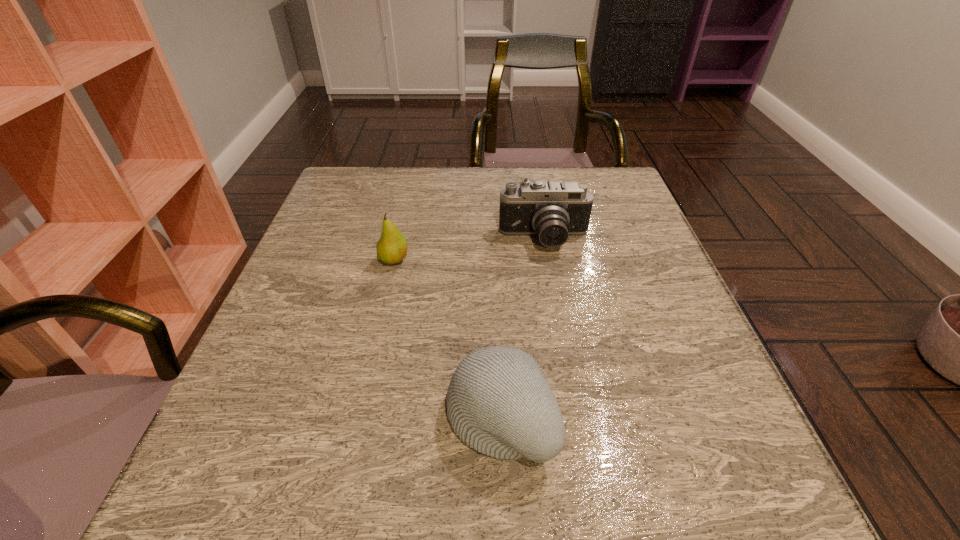
Identify the location of vacant area between the camera and the nearest object. (522, 328).

Locate an element on the screen. The height and width of the screenshot is (540, 960). free spot between the pear and the camera is located at coordinates (469, 250).

At what (x,y) coordinates should I click in order to perform the action: click on empty space that is in between the pear and the nearest object. Please return your answer as a coordinate pair (x, y). The height and width of the screenshot is (540, 960). Looking at the image, I should click on (446, 338).

At what (x,y) coordinates should I click in order to perform the action: click on empty location between the nearest object and the camera. Please return your answer as a coordinate pair (x, y). This screenshot has width=960, height=540. Looking at the image, I should click on [x=522, y=328].

Where is `vacant area that lies between the pear and the beanie`? The height and width of the screenshot is (540, 960). vacant area that lies between the pear and the beanie is located at coordinates (446, 338).

Point out which object is positioned as the second nearest to the pear. Please provide its 2D coordinates. Your answer should be formatted as a tuple, i.e. [(x, y)], where the tuple contains the x and y coordinates of a point satisfying the conditions above.

[(499, 402)]

Identify the location of the closest object relative to the nearest object. (391, 248).

Find the location of `vacant space that satisfies the following two spatial constraints: 1. on the front side of the beanie; 2. on the left side of the pear`. vacant space that satisfies the following two spatial constraints: 1. on the front side of the beanie; 2. on the left side of the pear is located at coordinates (358, 416).

This screenshot has width=960, height=540. Identify the location of vacant space that satisfies the following two spatial constraints: 1. on the front side of the nearest object; 2. on the left side of the leftmost object. (358, 416).